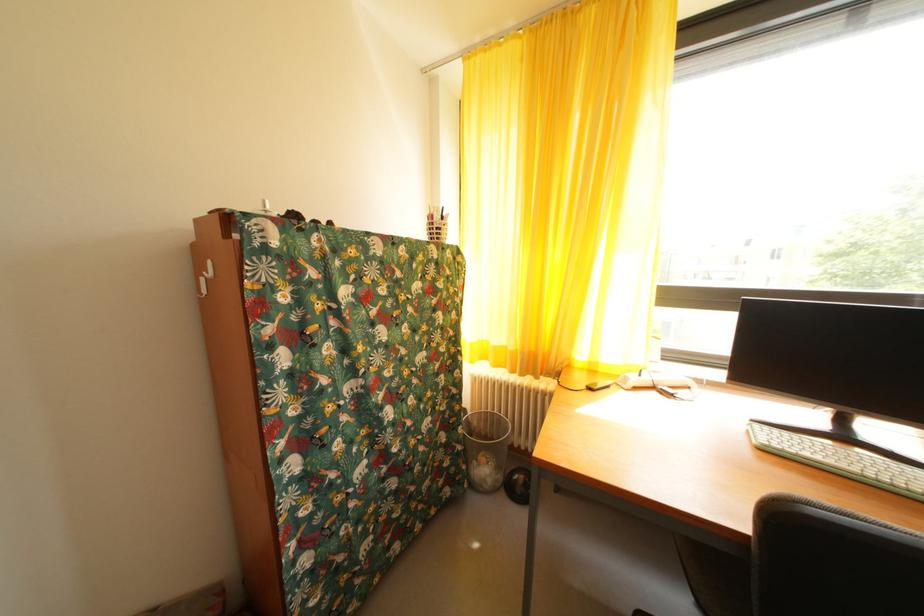
What do you see at coordinates (565, 187) in the screenshot?
I see `a yellow window curtain` at bounding box center [565, 187].